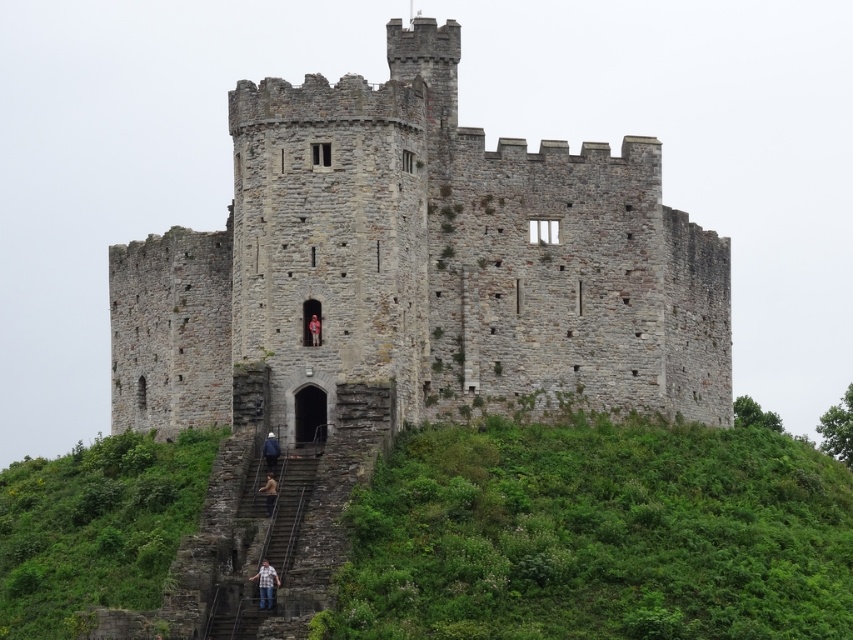
You are standing at the base of the castle hill and see two points marked on the castle wall. Which point, point (265, 586) or point (317, 317), is closer to you?

Point (265, 586) is closer to the viewer than point (317, 317).